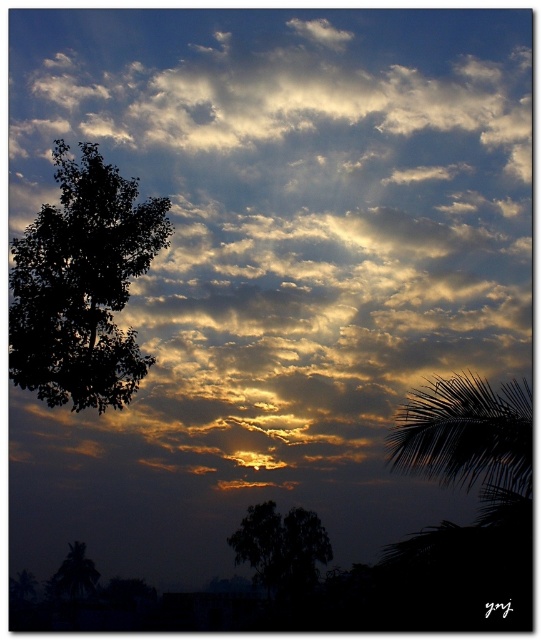
Based on the photo, you are standing in a field and see the dramatic sky scene described. You notice a point marked at coordinates (x=82, y=284). Which object does this point correspond to?

The point at coordinates (x=82, y=284) corresponds to the dark green leafy tree at left.